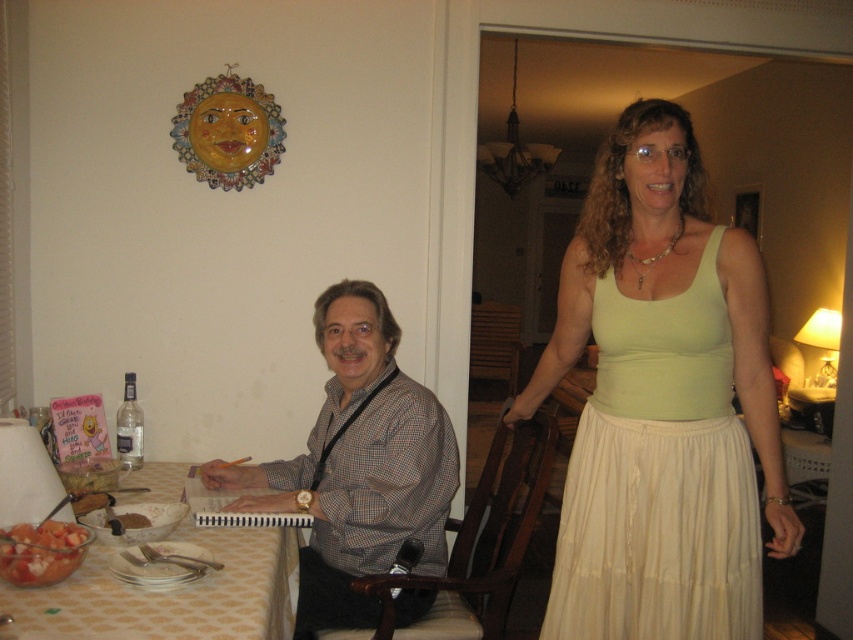
Question: Which point is farther to the camera?

Choices:
 (A) brown crumbly bread at table
 (B) tomato salad at table left
 (C) checkered fabric shirt at center

Answer: (C)

Question: Does light green fabric dress at right have a lesser width compared to tomato salad at table left?

Choices:
 (A) yes
 (B) no

Answer: (B)

Question: Which of the following is the farthest from the observer?

Choices:
 (A) (108, 611)
 (B) (730, 365)
 (C) (604, 352)
 (D) (299, 573)

Answer: (D)

Question: Is patterned fabric table at lower left closer to the viewer compared to tomato salad at table left?

Choices:
 (A) no
 (B) yes

Answer: (B)

Question: Which of the following is the farthest from the observer?

Choices:
 (A) light green fabric dress at right
 (B) checkered fabric shirt at center
 (C) patterned fabric table at lower left
 (D) light green fabric skirt at right

Answer: (B)

Question: Does light green fabric skirt at right appear under patterned fabric table at lower left?

Choices:
 (A) yes
 (B) no

Answer: (B)